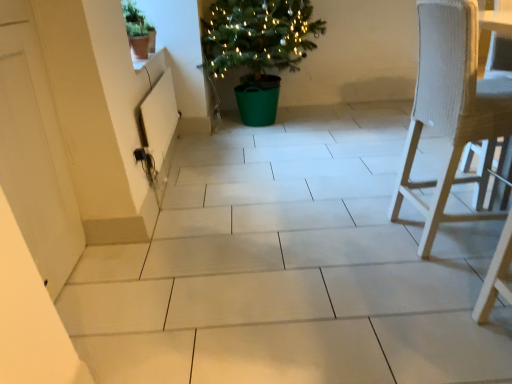
Question: Is white matte door at left thinner than green plastic potted plant at center, acting as the 2th houseplant starting from the front?

Choices:
 (A) yes
 (B) no

Answer: (A)

Question: Is white matte door at left located outside green plastic potted plant at center, which is the 1th houseplant from back to front?

Choices:
 (A) yes
 (B) no

Answer: (A)

Question: Considering the relative positions of white matte door at left and green plastic potted plant at center, which is the 1th houseplant from back to front, in the image provided, is white matte door at left in front of green plastic potted plant at center, which is the 1th houseplant from back to front,?

Choices:
 (A) yes
 (B) no

Answer: (A)

Question: Considering the relative sizes of white matte door at left and green plastic potted plant at center, which ranks as the 2th houseplant in left-to-right order, in the image provided, is white matte door at left smaller than green plastic potted plant at center, which ranks as the 2th houseplant in left-to-right order,?

Choices:
 (A) no
 (B) yes

Answer: (B)

Question: Can you confirm if white matte door at left is shorter than green plastic potted plant at center, which ranks as the 2th houseplant in left-to-right order?

Choices:
 (A) yes
 (B) no

Answer: (B)

Question: Considering the positions of white matte door at left and white woven chair at right in the image, is white matte door at left bigger or smaller than white woven chair at right?

Choices:
 (A) big
 (B) small

Answer: (B)

Question: In the image, is white matte door at left on the left side or the right side of white woven chair at right?

Choices:
 (A) left
 (B) right

Answer: (A)

Question: From the image's perspective, relative to white woven chair at right, is white matte door at left above or below?

Choices:
 (A) above
 (B) below

Answer: (B)

Question: Is point (48, 122) closer or farther from the camera than point (429, 107)?

Choices:
 (A) closer
 (B) farther

Answer: (A)

Question: Considering the positions of green plastic potted plant at center, which is the first houseplant from right to left, and green matte pot at upper left, which ranks as the 1th houseplant in left-to-right order, in the image, is green plastic potted plant at center, which is the first houseplant from right to left, taller or shorter than green matte pot at upper left, which ranks as the 1th houseplant in left-to-right order,?

Choices:
 (A) short
 (B) tall

Answer: (B)

Question: From a real-world perspective, is green plastic potted plant at center, which ranks as the 2th houseplant in left-to-right order, positioned above or below green matte pot at upper left, which is the first houseplant in front-to-back order?

Choices:
 (A) below
 (B) above

Answer: (A)

Question: Does point (266, 61) appear closer or farther from the camera than point (135, 56)?

Choices:
 (A) closer
 (B) farther

Answer: (B)

Question: Is green plastic potted plant at center, acting as the 2th houseplant starting from the front, spatially inside green matte pot at upper left, arranged as the second houseplant when viewed from the right, or outside of it?

Choices:
 (A) outside
 (B) inside

Answer: (A)

Question: Relative to white woven chair at right, is green matte pot at upper left, which is the second houseplant from back to front, in front or behind?

Choices:
 (A) behind
 (B) front

Answer: (A)

Question: From their relative heights in the image, would you say green matte pot at upper left, arranged as the second houseplant when viewed from the right, is taller or shorter than white woven chair at right?

Choices:
 (A) short
 (B) tall

Answer: (A)